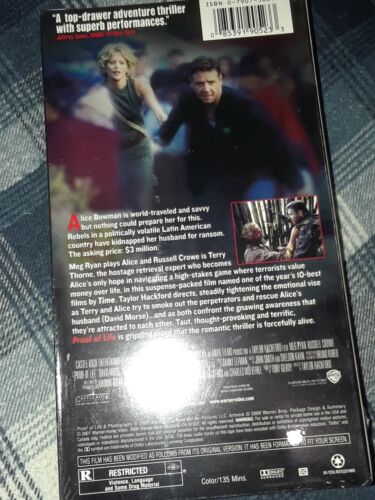
Locate an element on the screen. The height and width of the screenshot is (500, 375). sheet is located at coordinates (27, 340).